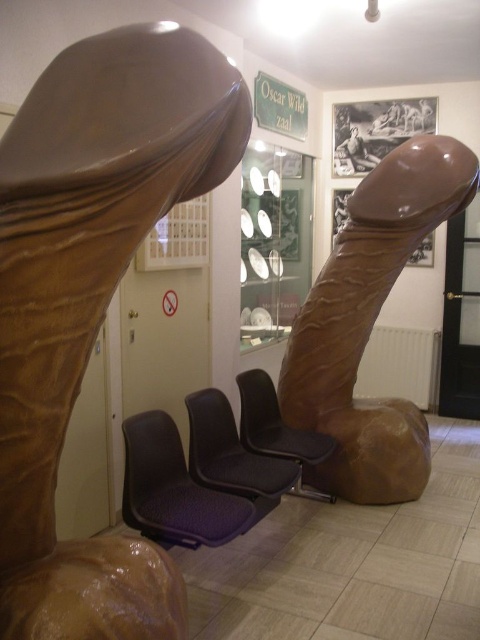
Question: Which point appears farthest from the camera in this image?

Choices:
 (A) (204, 483)
 (B) (252, 372)
 (C) (385, 193)

Answer: (B)

Question: Does brown rubber sculpture at left come in front of brown glossy sculpture at center?

Choices:
 (A) no
 (B) yes

Answer: (B)

Question: Which point is farther from the camera taking this photo?

Choices:
 (A) (295, 465)
 (B) (85, 307)
 (C) (436, 182)

Answer: (C)

Question: Among these points, which one is farthest from the camera?

Choices:
 (A) (180, 104)
 (B) (165, 515)
 (C) (207, 432)

Answer: (C)

Question: Does purple fabric daybed at center have a larger size compared to black fabric armchair at center?

Choices:
 (A) yes
 (B) no

Answer: (A)

Question: Is purple fabric armchair at center above matte black armchair at center?

Choices:
 (A) yes
 (B) no

Answer: (B)